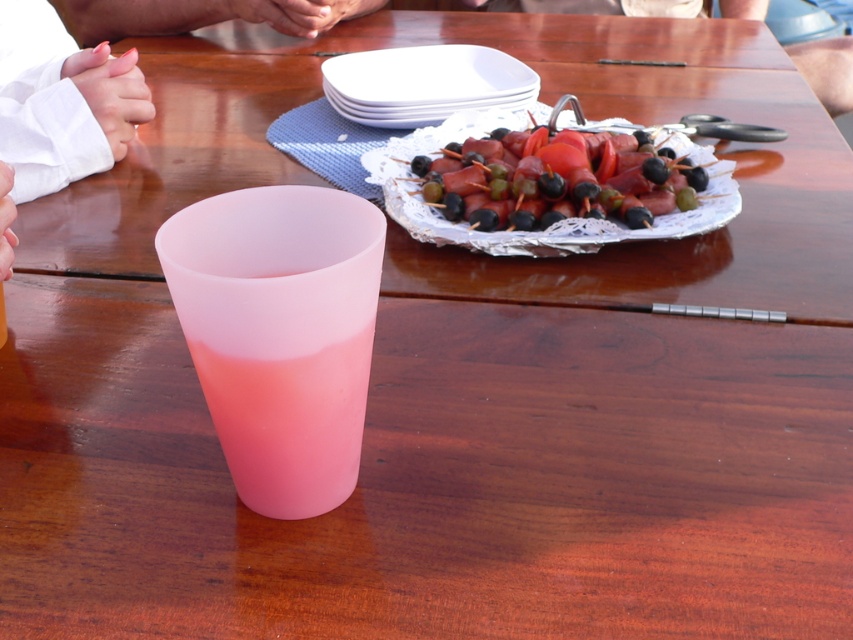
Question: Which of the following is the farthest from the observer?

Choices:
 (A) (270, 400)
 (B) (99, 129)
 (C) (648, 161)

Answer: (B)

Question: Is semi-glossy plastic skewers at upper right to the left of white satin cuffs at left from the viewer's perspective?

Choices:
 (A) no
 (B) yes

Answer: (A)

Question: Which point is farther from the camera taking this photo?

Choices:
 (A) click(x=0, y=28)
 (B) click(x=428, y=97)
 (C) click(x=654, y=182)
 (D) click(x=252, y=376)

Answer: (A)

Question: Can you confirm if translucent pink cup at center is positioned below semi-glossy plastic skewers at upper right?

Choices:
 (A) yes
 (B) no

Answer: (A)

Question: Which point is farther to the camera?

Choices:
 (A) translucent pink cup at center
 (B) semi-glossy plastic skewers at upper right

Answer: (B)

Question: Is semi-glossy plastic skewers at upper right thinner than white satin cuffs at left?

Choices:
 (A) yes
 (B) no

Answer: (A)